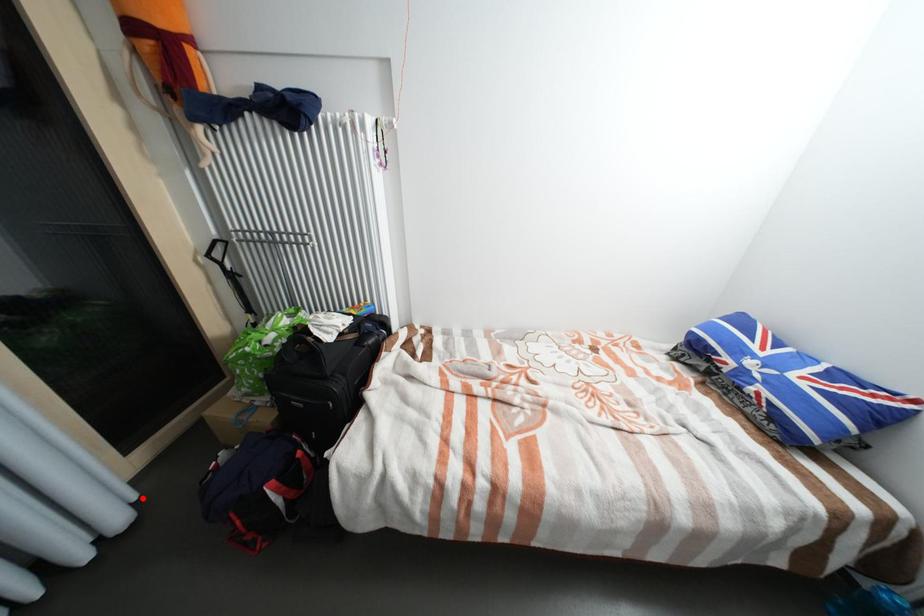
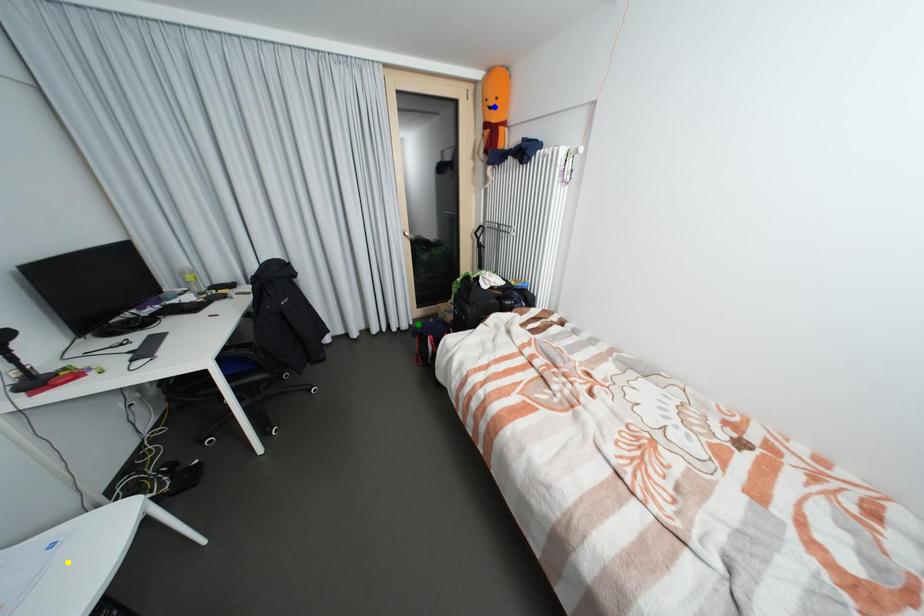
Question: I am providing you with two images of the same scene from different viewpoints. A red point is marked on the first image. You are given multiple points on the second image. Which point in image 2 represents the same 3d spot as the red point in image 1?

Choices:
 (A) blue point
 (B) green point
 (C) yellow point

Answer: (B)